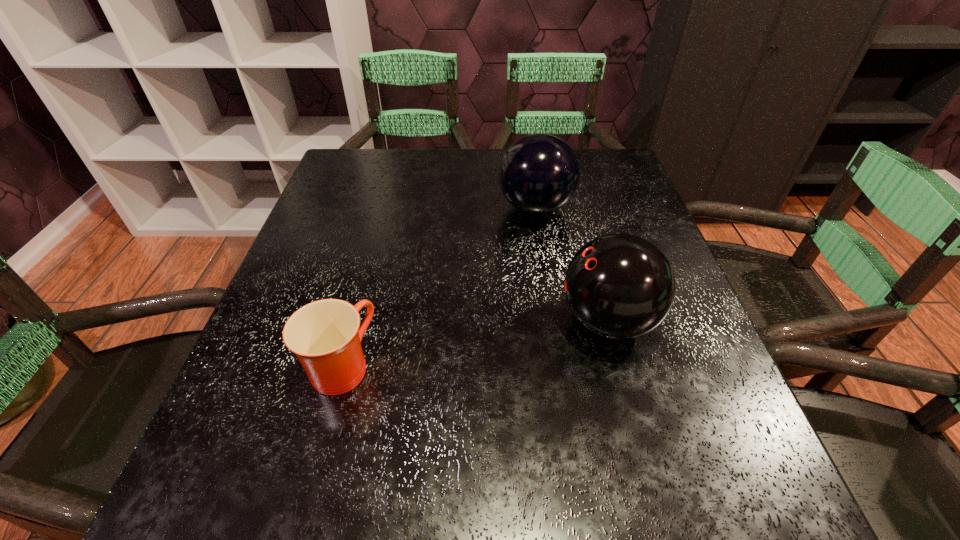
This screenshot has width=960, height=540. I want to click on vacant area between the shortest object and the nearer bowling ball, so click(x=474, y=343).

The image size is (960, 540). Identify the location of free space between the shortest object and the farthest object. (439, 287).

In order to click on free spot between the nearer bowling ball and the cup in this screenshot , I will do `click(474, 343)`.

You are a GUI agent. You are given a task and a screenshot of the screen. Output one action in this format:
    pyautogui.click(x=<x>, y=<y>)
    Task: Click on the free spot between the shortest object and the farther bowling ball
    This screenshot has height=540, width=960.
    Given the screenshot: What is the action you would take?
    pyautogui.click(x=439, y=287)

Identify which object is the second closest to the shortest object. Please provide its 2D coordinates. Your answer should be formatted as a tuple, i.e. [(x, y)], where the tuple contains the x and y coordinates of a point satisfying the conditions above.

[(539, 173)]

Image resolution: width=960 pixels, height=540 pixels. Find the location of `the closest object to the shortest object`. the closest object to the shortest object is located at coordinates [620, 286].

Identify the location of vacant point that satisfies the following two spatial constraints: 1. on the side of the farthest object with the finger holes; 2. on the front side of the cup. (560, 366).